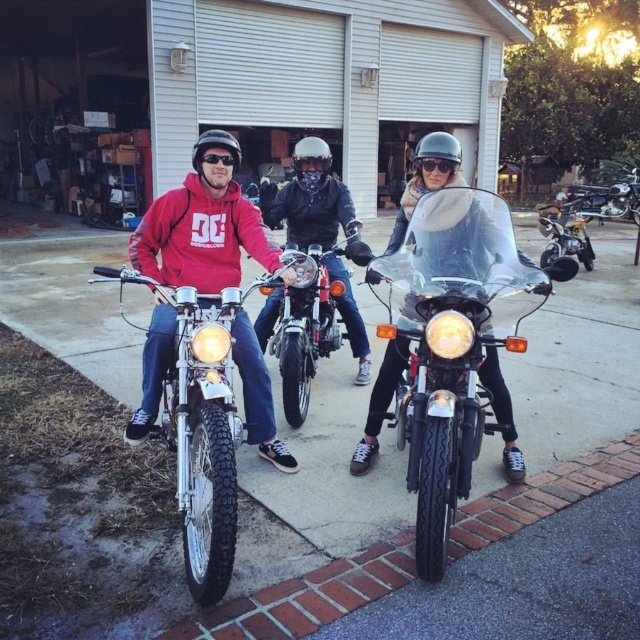
Between point (308, 157) and point (445, 164), which one is positioned in front?

Point (445, 164) is in front.

Is point (308, 189) positioned in front of point (445, 173)?

No, (308, 189) is behind (445, 173).

Find the location of a particular element. This screenshot has width=640, height=640. white matte helmet at center is located at coordinates (310, 163).

Image resolution: width=640 pixels, height=640 pixels. I want to click on white matte helmet at center, so click(x=310, y=163).

The image size is (640, 640). What are the coordinates of `matte red hoodie at center` in the screenshot? It's located at (202, 227).

Is point (150, 372) more distant than point (214, 589)?

Yes, point (150, 372) is behind point (214, 589).

The width and height of the screenshot is (640, 640). In order to click on matte red hoodie at center in this screenshot , I will do `click(202, 227)`.

Is gold metallic motorcycle at center in front of white matte helmet at center?

No, gold metallic motorcycle at center is further to the viewer.

Find the location of `gold metallic motorcycle at center`. gold metallic motorcycle at center is located at coordinates (564, 230).

This screenshot has width=640, height=640. In order to click on gold metallic motorcycle at center in this screenshot , I will do `click(564, 230)`.